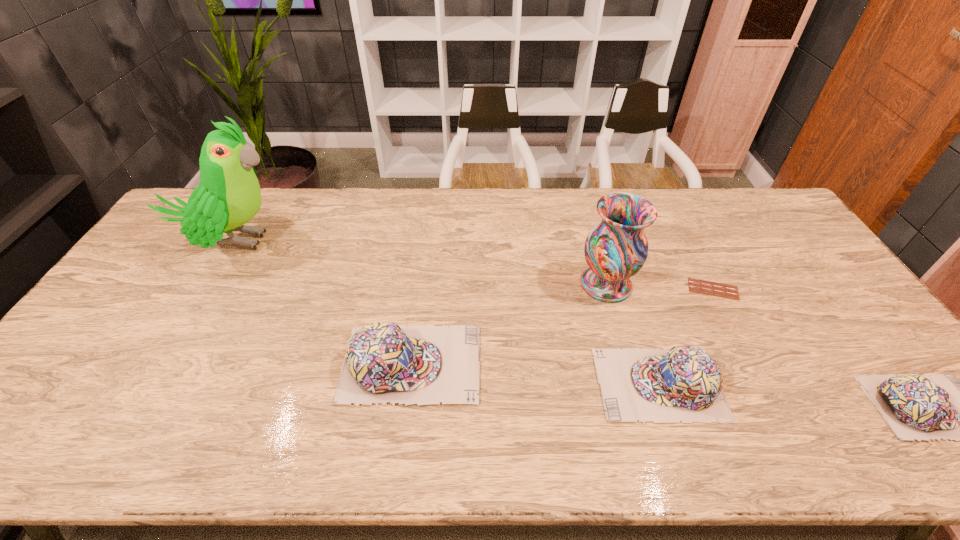
Image resolution: width=960 pixels, height=540 pixels. In order to click on vacant spot to place a cap on the left in this screenshot , I will do `click(181, 344)`.